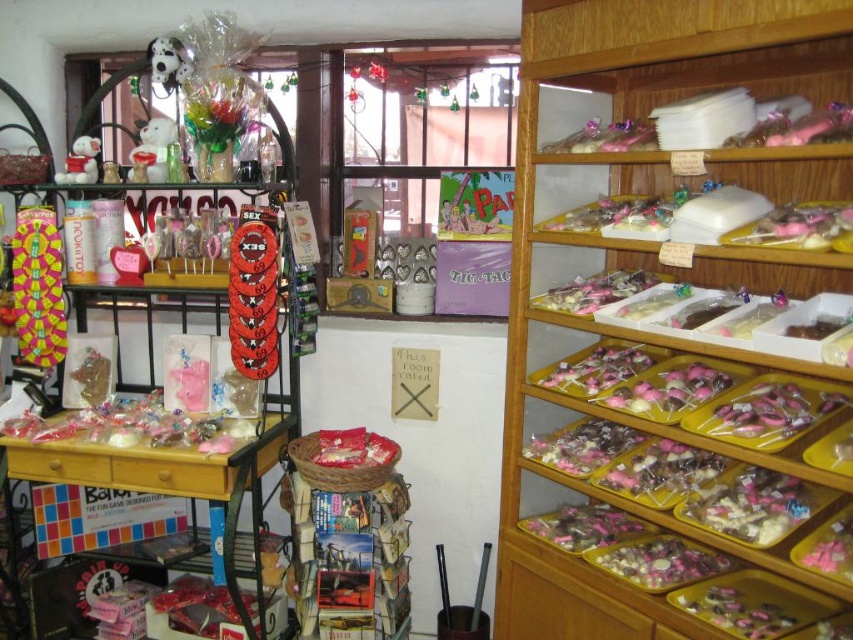
You are a delivery robot with a 40 cm wide package that needs to be placed between the red glossy disc at center and the white plush bear at upper left. Can the package fit in the space between them?

The distance between the red glossy disc at center and the white plush bear at upper left is 51.63 centimeters. Since the package is 40 cm wide, it can fit in the space between them as the distance is greater than the package width.

You are a customer in the shop and want to reach the red glossy disc at center to buy it. The white plush bear at upper left is blocking your view. Can you move the bear to access the disc?

The red glossy disc at center is below the white plush bear at upper left, so you can access the disc without moving the bear by reaching around or beneath it.